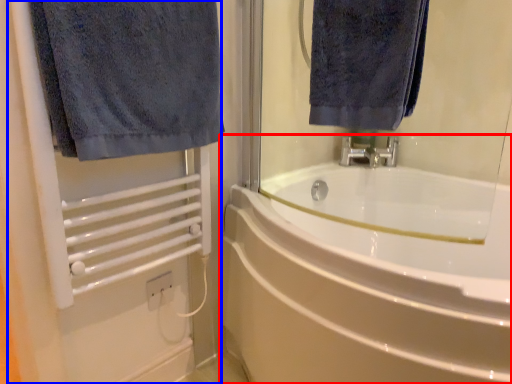
Question: Which object is further to the camera taking this photo, bathtub (highlighted by a red box) or screen door (highlighted by a blue box)?

Choices:
 (A) bathtub
 (B) screen door

Answer: (B)